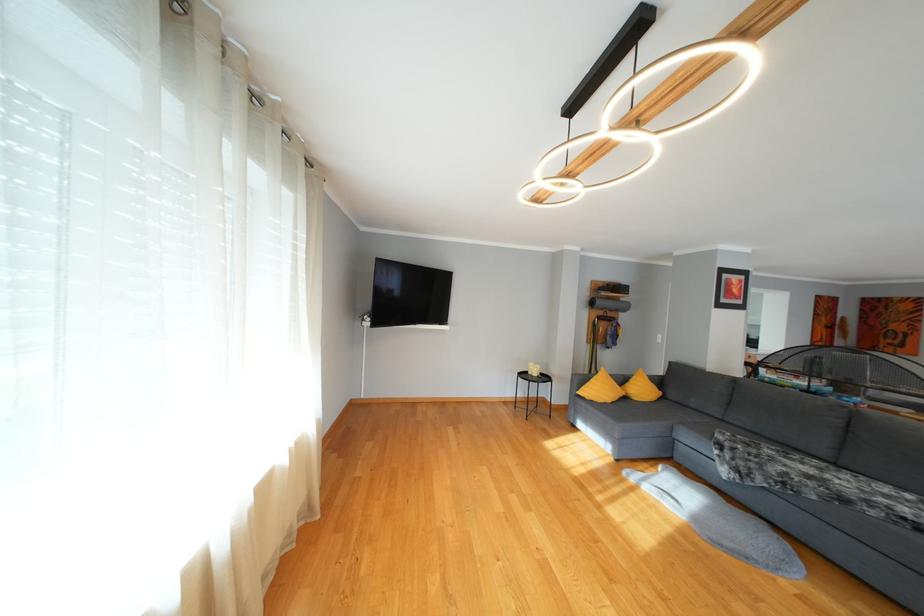
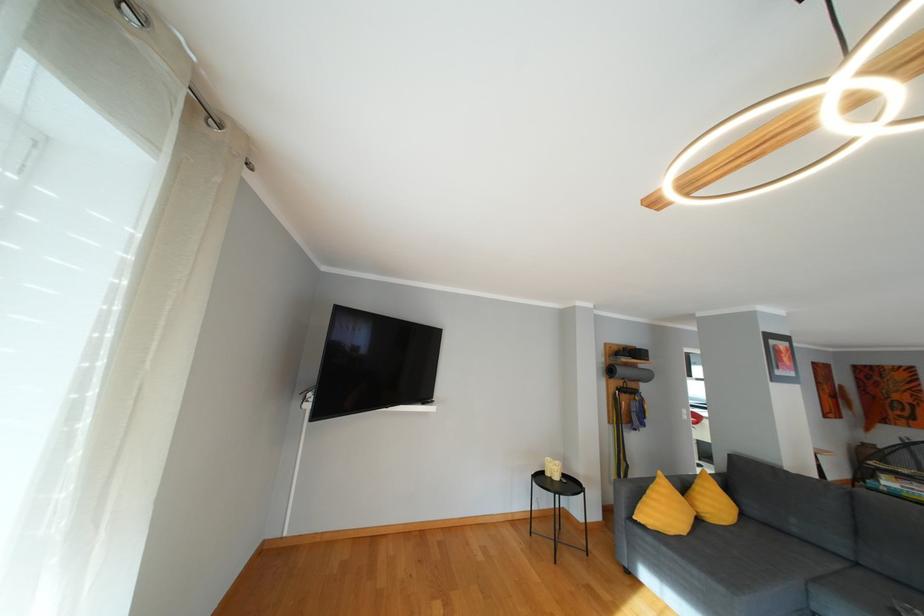
Question: In a continuous first-person perspective shot, in which direction is the camera moving?

Choices:
 (A) Left
 (B) Right
 (C) Forward
 (D) Backward

Answer: (C)